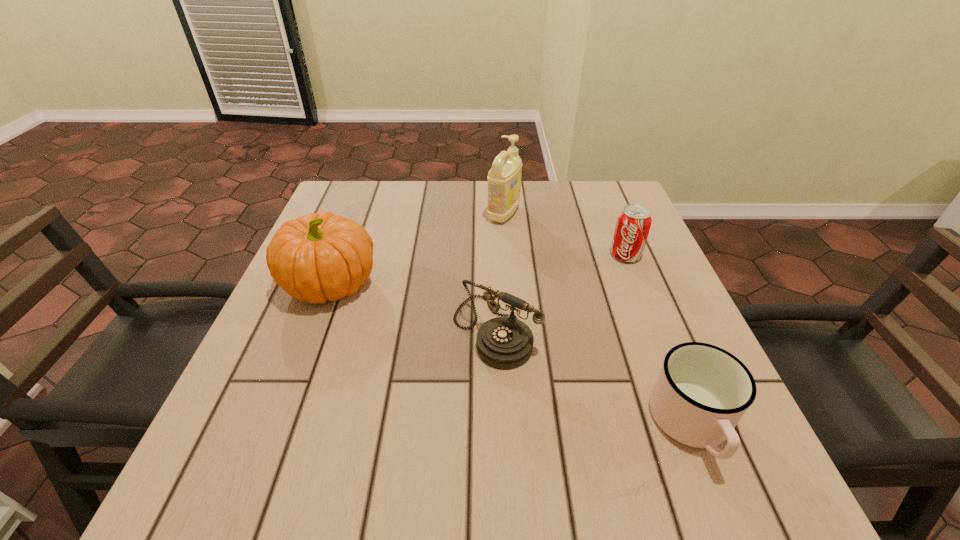
Locate an element on the screen. object situated at the near edge is located at coordinates (702, 391).

In order to click on object that is at the left edge in this screenshot , I will do `click(318, 257)`.

Where is `soda that is at the right edge`? soda that is at the right edge is located at coordinates (633, 225).

Find the location of a particular element. The height and width of the screenshot is (540, 960). mug at the right edge is located at coordinates (702, 391).

In order to click on object that is at the near right corner in this screenshot , I will do `click(702, 391)`.

Find the location of a particular element. This screenshot has width=960, height=540. free space at the far edge of the desktop is located at coordinates (549, 183).

In the image, there is a desktop. In order to click on vacant space at the near edge in this screenshot , I will do `click(514, 468)`.

Where is `vacant space at the right edge of the desktop`? The width and height of the screenshot is (960, 540). vacant space at the right edge of the desktop is located at coordinates (584, 234).

The height and width of the screenshot is (540, 960). What are the coordinates of `blank space at the far left corner of the desktop` in the screenshot? It's located at (379, 181).

Find the location of a particular element. Image resolution: width=960 pixels, height=540 pixels. vacant space at the far right corner of the desktop is located at coordinates (612, 223).